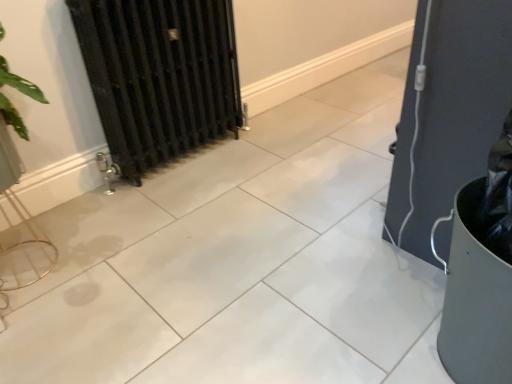
Where is `free space between matte black guitar case at right and black metal radiator at left`? This screenshot has width=512, height=384. free space between matte black guitar case at right and black metal radiator at left is located at coordinates (276, 178).